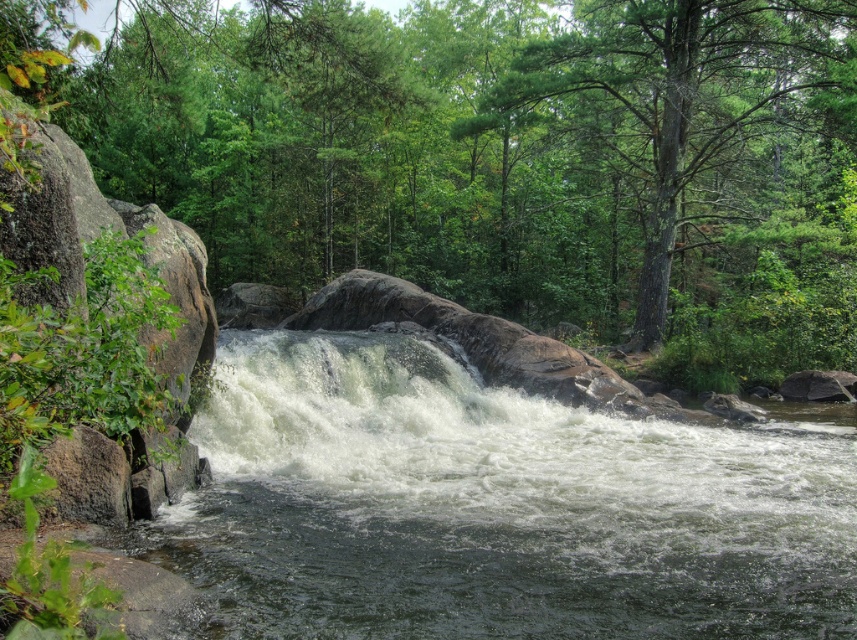
Who is positioned more to the right, green leafy forest at center or green textured tree at upper center?

green textured tree at upper center

Is point (825, 355) closer to camera compared to point (610, 17)?

That is True.

I want to click on green leafy forest at center, so click(508, 160).